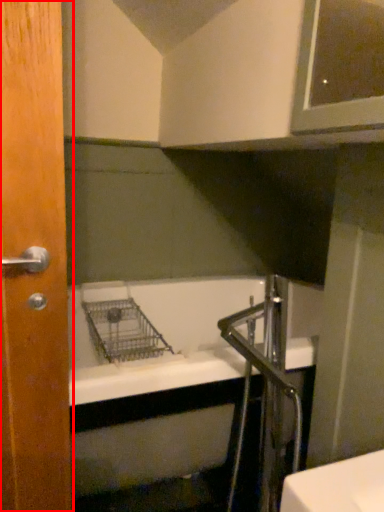
Question: Observing the image, what is the correct spatial positioning of door (annotated by the red box) in reference to faucet?

Choices:
 (A) right
 (B) left

Answer: (B)